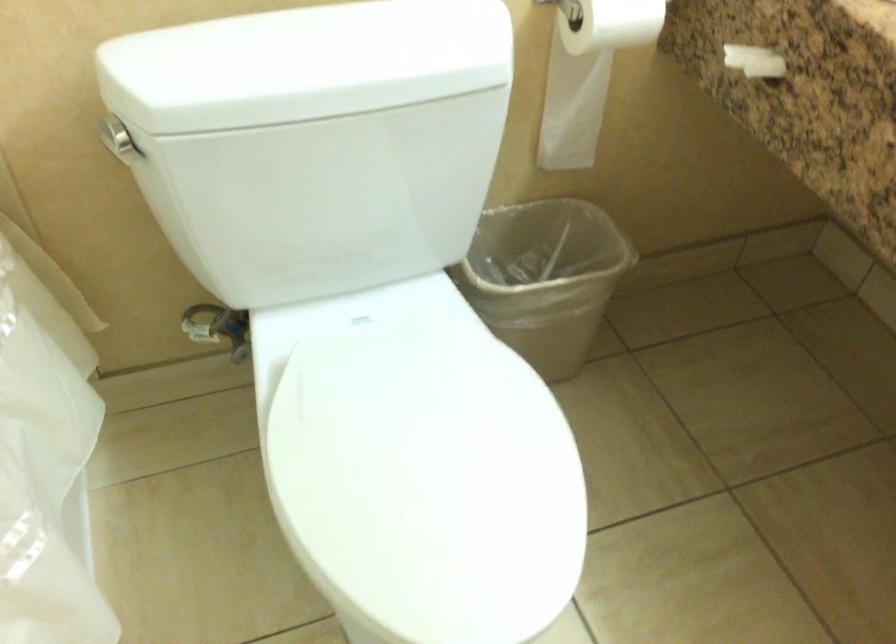
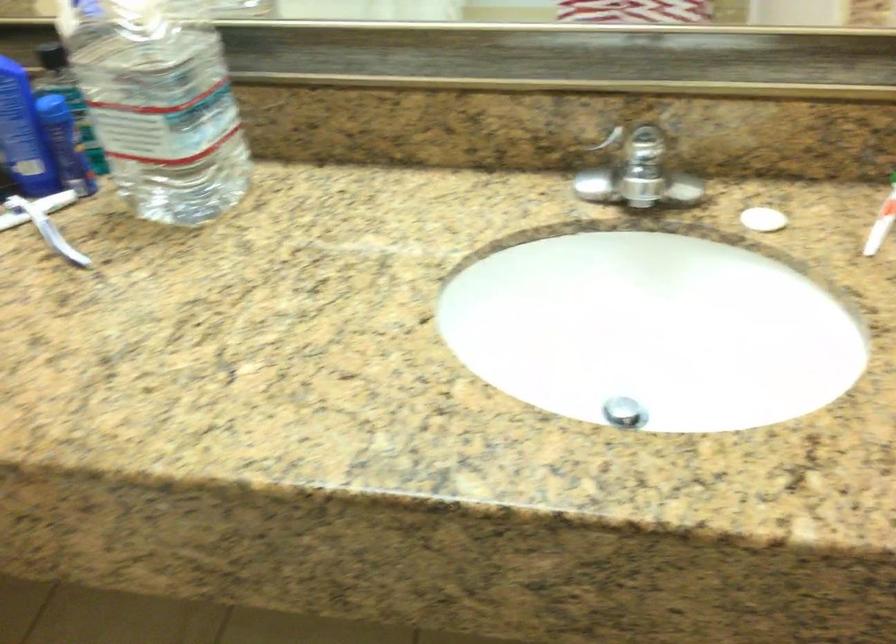
Question: The first image is from the beginning of the video and the second image is from the end. How did the camera likely rotate when shooting the video?

Choices:
 (A) Left
 (B) Right
 (C) Up
 (D) Down

Answer: (B)